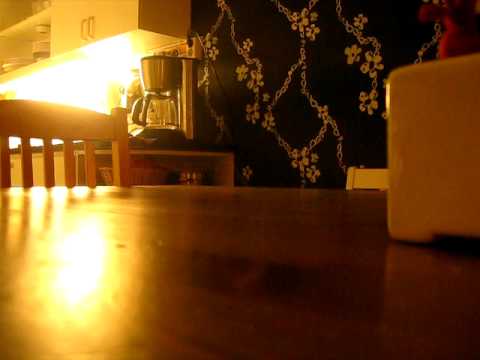
The height and width of the screenshot is (360, 480). I want to click on chair, so click(x=80, y=126).